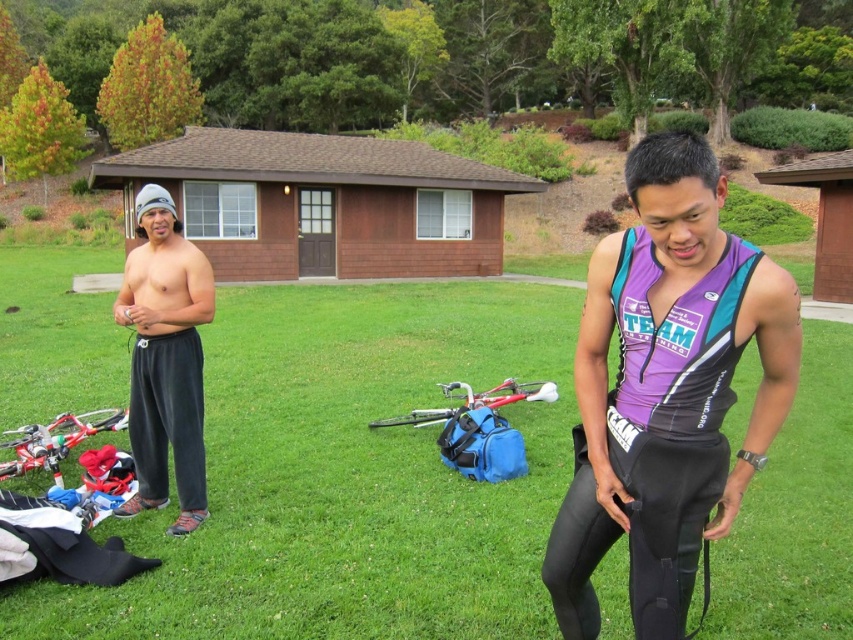
You are a fashion designer observing two outfits in the scene. The first is the purple fabric triathlon suit at center, and the second is the gray sweatpants at left. Which outfit has a shorter length?

The purple fabric triathlon suit at center is shorter than the gray sweatpants at left, so the purple fabric triathlon suit at center has a shorter length.

You are planning to place a 10 feet long bench between the purple fabric triathlon suit at center and the gray sweatpants at left. Will the bench fit in the space between them?

The distance between the purple fabric triathlon suit at center and the gray sweatpants at left is 8.00 feet. Since the bench is 10 feet long, it will not fit in the available space.